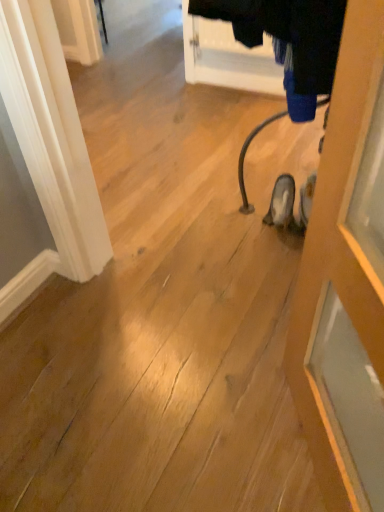
The height and width of the screenshot is (512, 384). Describe the element at coordinates (227, 57) in the screenshot. I see `black fabric screen door at upper center` at that location.

What is the approximate width of black fabric screen door at upper center?

2.79 inches.

At what (x,y) coordinates should I click in order to perform the action: click on black fabric screen door at upper center. Please return your answer as a coordinate pair (x, y). Image resolution: width=384 pixels, height=512 pixels. Looking at the image, I should click on (227, 57).

Where is `black fabric screen door at upper center`? Image resolution: width=384 pixels, height=512 pixels. black fabric screen door at upper center is located at coordinates (227, 57).